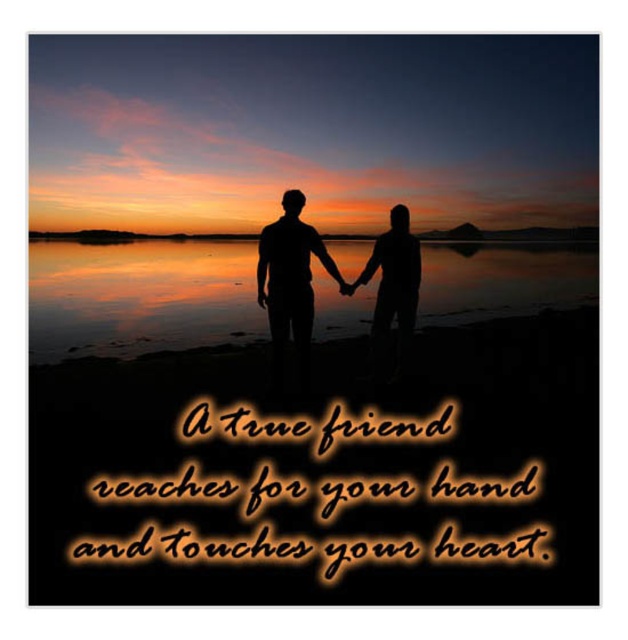
You are standing on the shore in the sunset scene and want to place a small decorative rock between the two points marked as point (306, 304) and point (409, 285). Which point should you place it closer to if you want the rock to be more visible to someone approaching from the front?

You should place the rock closer to point (306, 304) because it is closer to the viewer, making it more visible to someone approaching from the front.

You are a photographer trying to capture the sunset scene. You notice two black matte silhouettes at center. Which one is closer to the camera, the black matte silhouette at center or the black matte silhouette of person at center?

The black matte silhouette at center is in front of the black matte silhouette of person at center, so it is closer to the camera.